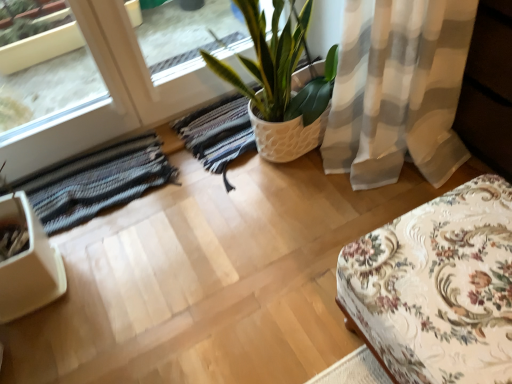
What is the approximate height of floral fabric ottoman at lower right?

The height of floral fabric ottoman at lower right is 35.94 centimeters.

Locate an element on the screen. white textured pot at center is located at coordinates (282, 84).

You are a GUI agent. You are given a task and a screenshot of the screen. Output one action in this format:
    pyautogui.click(x=<x>, y=<y>)
    Task: Click on the floral fabric ottoman at lower right
    
    Given the screenshot: What is the action you would take?
    pyautogui.click(x=437, y=287)

What's the angular difference between striped woolen rug at lower left and white textured pot at center's facing directions?

2.67 degrees.

Considering the relative sizes of striped woolen rug at lower left and white textured pot at center in the image provided, is striped woolen rug at lower left thinner than white textured pot at center?

Yes.

Are striped woolen rug at lower left and white textured pot at center beside each other?

They are not placed beside each other.

Who is bigger, striped woolen rug at lower left or white textured pot at center?

white textured pot at center is bigger.

Who is shorter, floral fabric ottoman at lower right or white textured pot at center?

floral fabric ottoman at lower right.

Which object is positioned more to the left, floral fabric ottoman at lower right or white textured pot at center?

white textured pot at center is more to the left.

From the picture: Is floral fabric ottoman at lower right outside of white textured pot at center?

Absolutely, floral fabric ottoman at lower right is external to white textured pot at center.

Which is nearer, (x=75, y=196) or (x=445, y=229)?

The point (x=445, y=229) is closer.

From the picture: Can you confirm if striped woolen rug at lower left is positioned to the right of floral fabric ottoman at lower right?

No.

Locate an element on the screen. furniture above the striped woolen rug at lower left (from a real-world perspective) is located at coordinates (437, 287).

Measure the distance from striped woolen rug at lower left to floral fabric ottoman at lower right.

striped woolen rug at lower left and floral fabric ottoman at lower right are 36.52 inches apart from each other.

Does white textured pot at center have a smaller size compared to floral fabric ottoman at lower right?

No.

Which of these two, white textured pot at center or floral fabric ottoman at lower right, stands shorter?

With less height is floral fabric ottoman at lower right.

How many degrees apart are the facing directions of white textured pot at center and floral fabric ottoman at lower right?

white textured pot at center and floral fabric ottoman at lower right are facing 92.5 degrees away from each other.

Is white textured pot at center in front of striped woolen rug at lower left?

Yes, white textured pot at center is closer to the camera.

Are white textured pot at center and striped woolen rug at lower left making contact?

No, white textured pot at center is not touching striped woolen rug at lower left.

Is white textured pot at center at the right side of striped woolen rug at lower left?

Correct, you'll find white textured pot at center to the right of striped woolen rug at lower left.

How far apart are white textured pot at center and striped woolen rug at lower left?

19.83 inches.

In the scene shown: How far apart are floral fabric ottoman at lower right and striped woolen rug at lower left?

The distance of floral fabric ottoman at lower right from striped woolen rug at lower left is 92.76 centimeters.

Is striped woolen rug at lower left a part of floral fabric ottoman at lower right?

No, striped woolen rug at lower left is located outside of floral fabric ottoman at lower right.

Between floral fabric ottoman at lower right and striped woolen rug at lower left, which one has more height?

floral fabric ottoman at lower right.

The height and width of the screenshot is (384, 512). Find the location of `houseplant in front of the striped woolen rug at lower left`. houseplant in front of the striped woolen rug at lower left is located at coordinates [x=282, y=84].

I want to click on furniture on the right of white textured pot at center, so click(437, 287).

Which object lies nearer to the anchor point striped woolen rug at lower left, white textured pot at center or floral fabric ottoman at lower right?

white textured pot at center.

From the image, which object appears to be nearer to white textured pot at center, striped woolen rug at lower left or floral fabric ottoman at lower right?

striped woolen rug at lower left is positioned closer to the anchor white textured pot at center.

From the image, which object appears to be farther from striped woolen rug at lower left, floral fabric ottoman at lower right or white textured pot at center?

floral fabric ottoman at lower right.

Based on their spatial positions, is striped woolen rug at lower left or white textured pot at center closer to floral fabric ottoman at lower right?

white textured pot at center.

When comparing their distances from floral fabric ottoman at lower right, does white textured pot at center or striped woolen rug at lower left seem closer?

white textured pot at center lies closer to floral fabric ottoman at lower right than the other object.

When comparing their distances from white textured pot at center, does floral fabric ottoman at lower right or striped woolen rug at lower left seem further?

floral fabric ottoman at lower right is positioned further to the anchor white textured pot at center.

The width and height of the screenshot is (512, 384). I want to click on houseplant located between striped woolen rug at lower left and floral fabric ottoman at lower right in the left-right direction, so click(x=282, y=84).